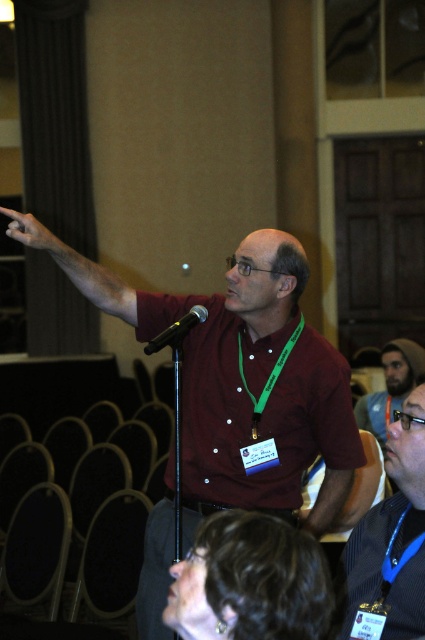
Looking at the image of the conference room scene, you notice two people with dark brown hair. The first has dark brown hair at lower center and the second has dark brown hair at upper right. Which of these two individuals has longer hair?

The dark brown hair at upper right is longer than the dark brown hair at lower center.